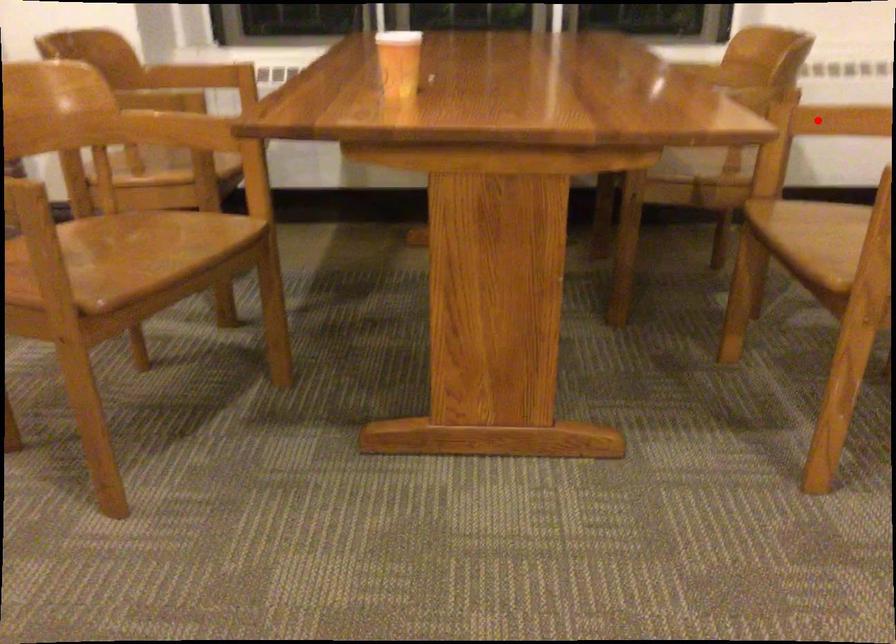
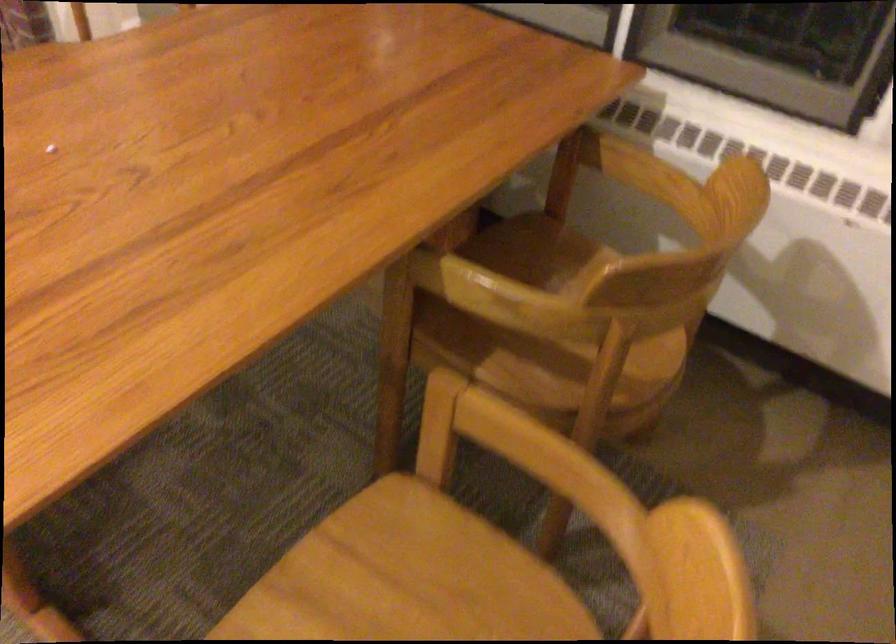
Question: I am providing you with two images of the same scene from different viewpoints. In image1, a red point is highlighted. Considering the same 3D point in image2, which of the following is correct?

Choices:
 (A) It is closer
 (B) It is farther

Answer: (A)